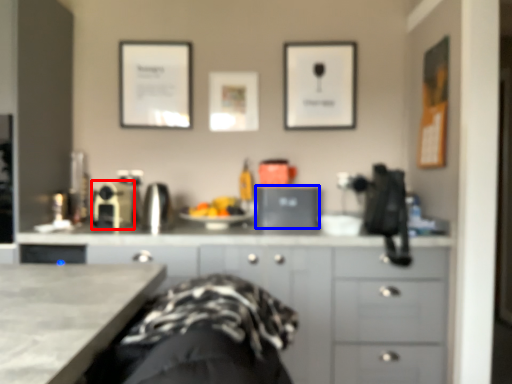
Question: Which object is further to the camera taking this photo, appliance (highlighted by a red box) or appliance (highlighted by a blue box)?

Choices:
 (A) appliance
 (B) appliance

Answer: (B)